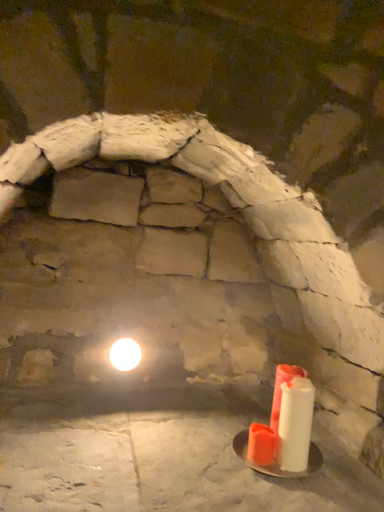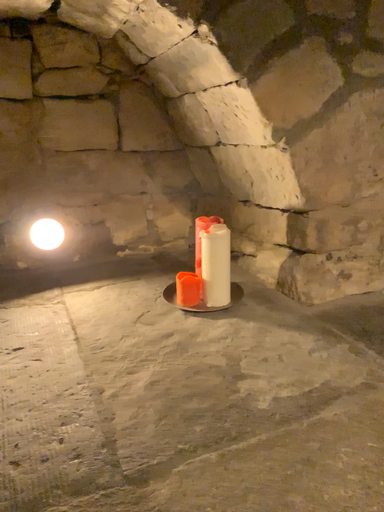
Question: Which way did the camera rotate in the video?

Choices:
 (A) rotated left
 (B) rotated right

Answer: (B)